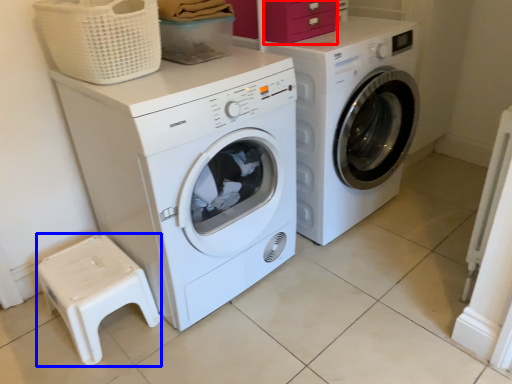
Question: Which of the following is the farthest to the observer, drawer (highlighted by a red box) or step stool (highlighted by a blue box)?

Choices:
 (A) drawer
 (B) step stool

Answer: (A)